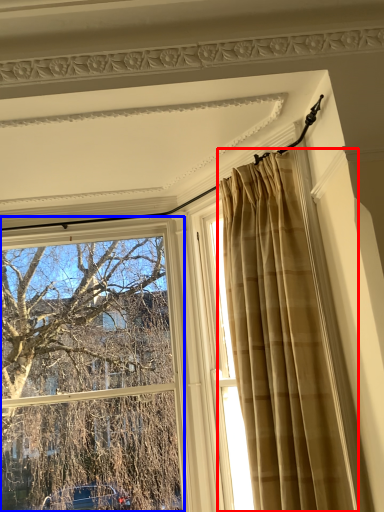
Question: Which of the following is the closest to the observer, curtain (highlighted by a red box) or window (highlighted by a blue box)?

Choices:
 (A) curtain
 (B) window

Answer: (A)